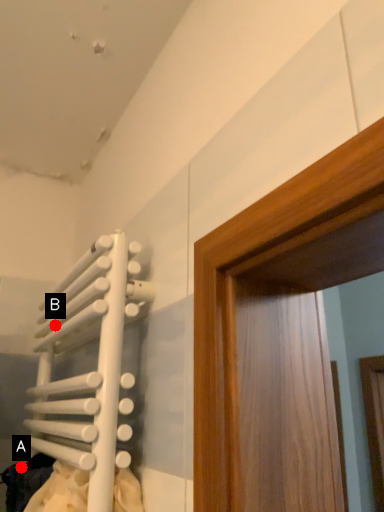
Question: Two points are circled on the image, labeled by A and B beside each circle. Which point appears closest to the camera in this image?

Choices:
 (A) A is closer
 (B) B is closer

Answer: (A)